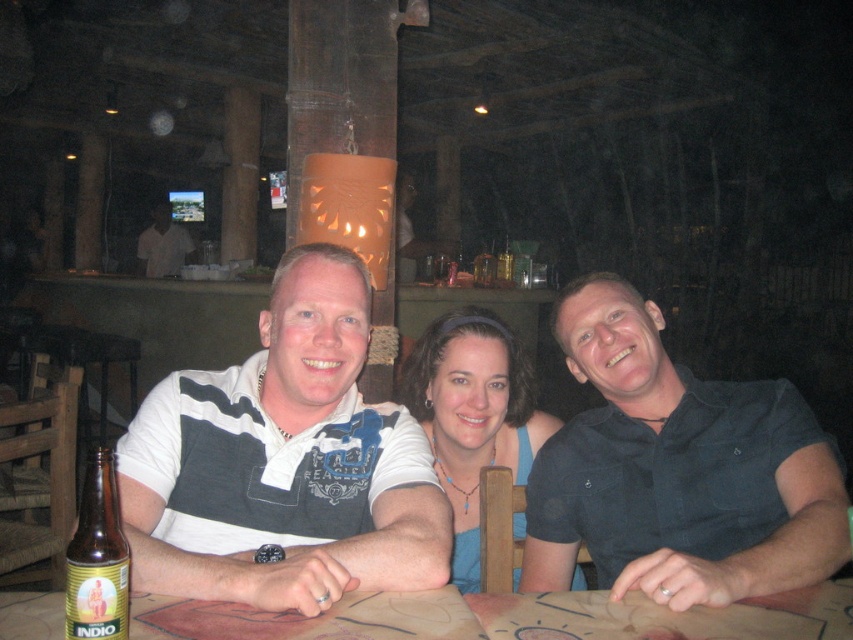
Is point (720, 467) closer to camera compared to point (498, 259)?

That is True.

Describe the element at coordinates (677, 470) in the screenshot. This screenshot has width=853, height=640. I see `dark blue shirt at center` at that location.

Image resolution: width=853 pixels, height=640 pixels. Identify the location of dark blue shirt at center. (677, 470).

Between white striped polo shirt at center and dark blue shirt at center, which one is positioned lower?

dark blue shirt at center

Does white striped polo shirt at center have a larger size compared to dark blue shirt at center?

Incorrect, white striped polo shirt at center is not larger than dark blue shirt at center.

Is point (260, 504) farther from viewer compared to point (762, 401)?

No, (260, 504) is closer to viewer.

The height and width of the screenshot is (640, 853). What are the coordinates of `white striped polo shirt at center` in the screenshot? It's located at (283, 461).

Which is more to the right, white striped polo shirt at center or brown glass bottle at lower left?

From the viewer's perspective, white striped polo shirt at center appears more on the right side.

Which is above, white striped polo shirt at center or brown glass bottle at lower left?

white striped polo shirt at center is above.

Is point (323, 515) farther from viewer compared to point (71, 547)?

Yes, point (323, 515) is behind point (71, 547).

The width and height of the screenshot is (853, 640). I want to click on white striped polo shirt at center, so click(x=283, y=461).